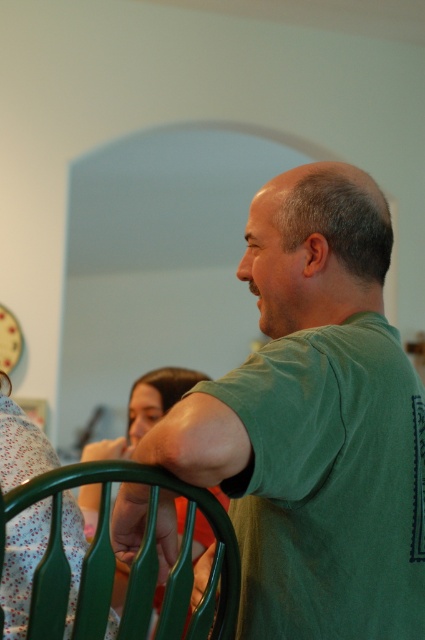
Does green matte shirt at center have a greater height compared to matte floral dress at lower left?

Yes.

Is point (351, 196) less distant than point (209, 538)?

Yes, it is in front of point (209, 538).

Identify the location of green matte shirt at center. (314, 422).

Based on the photo, can you confirm if green matte shirt at center is positioned to the left of green plastic chair at lower left?

No, green matte shirt at center is not to the left of green plastic chair at lower left.

Identify the location of green matte shirt at center. (314, 422).

This screenshot has width=425, height=640. I want to click on green matte shirt at center, so click(314, 422).

Does point (278, 497) come farther from viewer compared to point (204, 573)?

No, (278, 497) is in front of (204, 573).

Is point (404, 522) positioned after point (201, 568)?

No, it is in front of (201, 568).

Image resolution: width=425 pixels, height=640 pixels. In order to click on green matte shirt at center in this screenshot , I will do `click(314, 422)`.